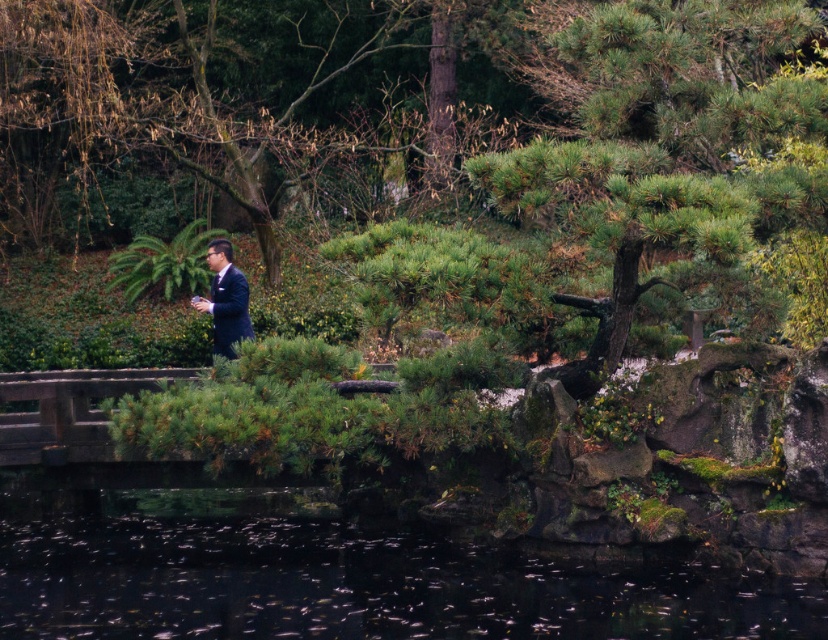
Between transparent water at lower center and matte black suit at center, which one has more height?

matte black suit at center

Locate an element on the screen. This screenshot has width=828, height=640. transparent water at lower center is located at coordinates (328, 570).

Find the location of a particular element. transparent water at lower center is located at coordinates (328, 570).